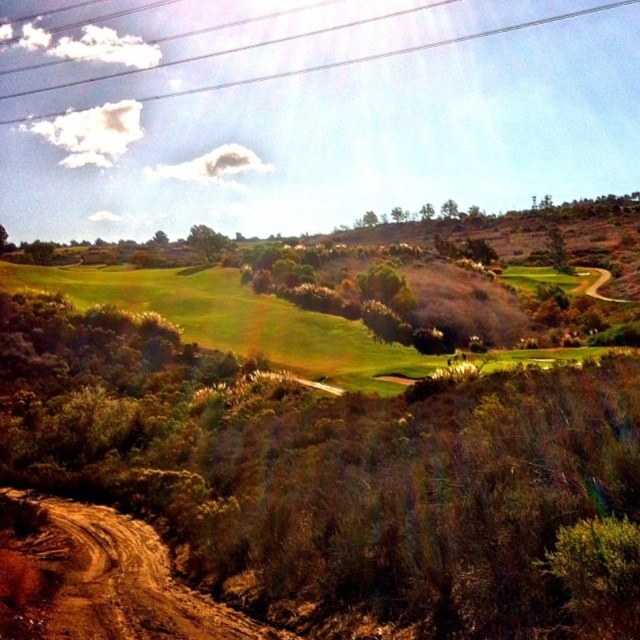
You are a golfer preparing to hit a ball from the brown dirt track at lower left towards the metallic wires at upper center. Considering their sizes, which object will appear closer in size when viewed from your position on the track?

The brown dirt track at lower left is smaller than the metallic wires at upper center, so the metallic wires at upper center will appear larger in size when viewed from the position on the track.

You are a golfer standing at the tee box and want to hit your ball towards the green. There are two obstacles in your path. You see the brown dirt track at lower left and the metallic wires at upper center. Which obstacle is located more to the left side of the other?

The brown dirt track at lower left is positioned on the left side of metallic wires at upper center, so the brown dirt track at lower left is more to the left compared to the metallic wires at upper center.